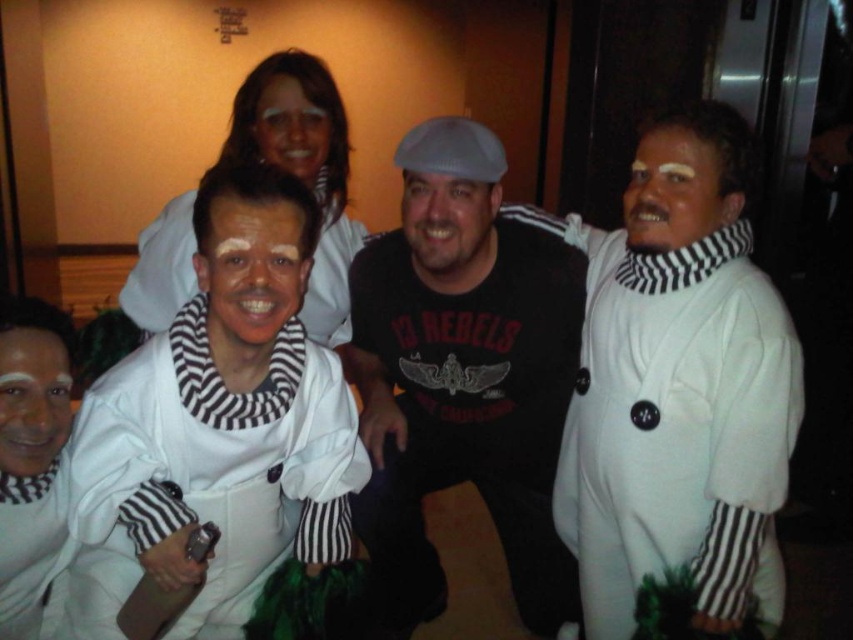
Does black matte shirt at center have a lesser width compared to white matte robe at right?

No.

Can you confirm if black matte shirt at center is taller than white matte robe at right?

Yes, black matte shirt at center is taller than white matte robe at right.

You are a GUI agent. You are given a task and a screenshot of the screen. Output one action in this format:
    pyautogui.click(x=<x>, y=<y>)
    Task: Click on the black matte shirt at center
    The height and width of the screenshot is (640, 853).
    Given the screenshot: What is the action you would take?
    pyautogui.click(x=463, y=376)

Which is in front, point (335, 358) or point (728, 349)?

Point (728, 349) is in front.

Is white matte jumpsuit at center thinner than white matte robe at right?

No, white matte jumpsuit at center is not thinner than white matte robe at right.

In the scene shown: Who is more forward, (167, 632) or (659, 397)?

Positioned in front is point (167, 632).

You are a GUI agent. You are given a task and a screenshot of the screen. Output one action in this format:
    pyautogui.click(x=<x>, y=<y>)
    Task: Click on the white matte jumpsuit at center
    This screenshot has height=640, width=853.
    Given the screenshot: What is the action you would take?
    coord(213,419)

Between white matte jumpsuit at center and black matte shirt at center, which one is positioned lower?

black matte shirt at center is lower down.

Which is more to the left, white matte jumpsuit at center or black matte shirt at center?

From the viewer's perspective, white matte jumpsuit at center appears more on the left side.

Identify the location of white matte jumpsuit at center. (213, 419).